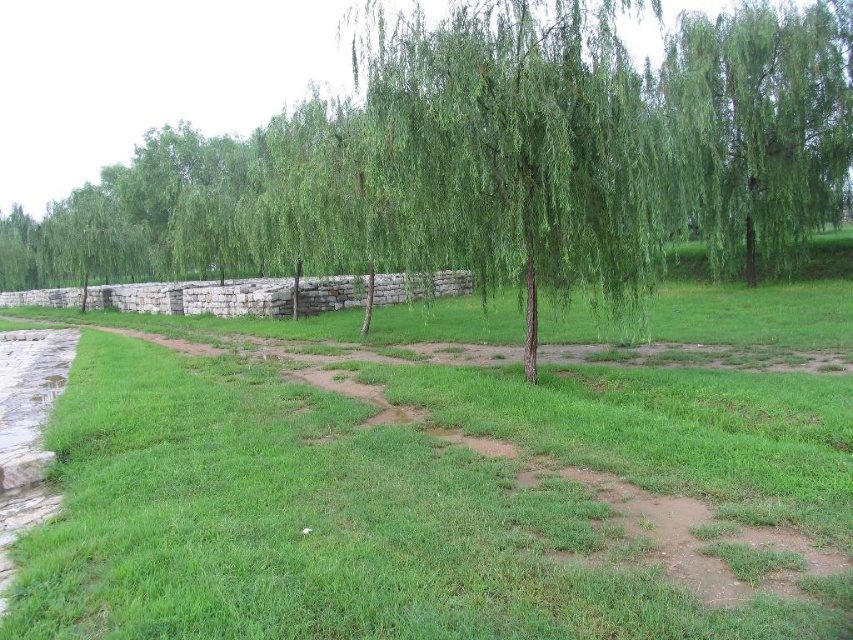
Does green grassy at center appear on the right side of green leafy willow at upper right?

Incorrect, green grassy at center is not on the right side of green leafy willow at upper right.

Find the location of `green grassy at center`. green grassy at center is located at coordinates (323, 525).

You are a GUI agent. You are given a task and a screenshot of the screen. Output one action in this format:
    pyautogui.click(x=<x>, y=<y>)
    Task: Click on the green grassy at center
    This screenshot has width=853, height=640.
    Given the screenshot: What is the action you would take?
    pyautogui.click(x=323, y=525)

Between point (167, 499) and point (790, 141), which one is positioned in front?

Point (167, 499) is in front.

Is point (195, 529) positioned in front of point (761, 189)?

Yes, point (195, 529) is closer to viewer.

This screenshot has height=640, width=853. I want to click on green grassy at center, so click(323, 525).

Describe the element at coordinates (492, 157) in the screenshot. This screenshot has height=640, width=853. I see `green leafy tree at center` at that location.

Image resolution: width=853 pixels, height=640 pixels. What are the coordinates of `green leafy tree at center` in the screenshot? It's located at (492, 157).